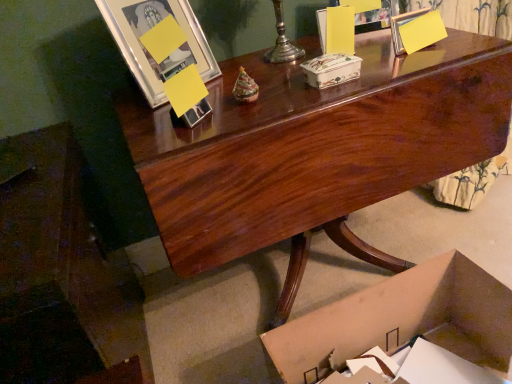
The image size is (512, 384). Find the location of `vacant area that lies to the right of porcelain floral box at center, the second box when ordered from bottom to top`. vacant area that lies to the right of porcelain floral box at center, the second box when ordered from bottom to top is located at coordinates (391, 69).